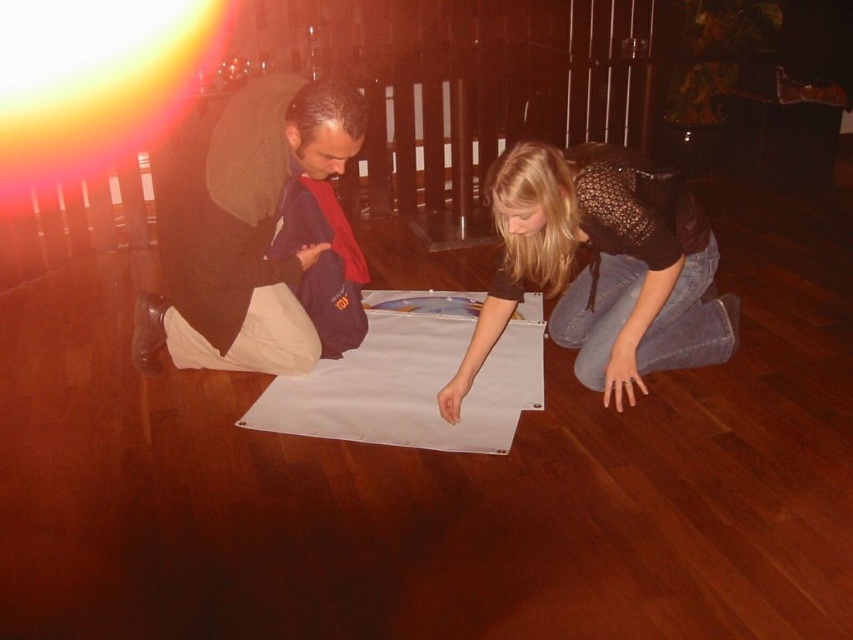
Question: In this image, where is denim jeans at lower right located relative to white matte cloth at center?

Choices:
 (A) below
 (B) above

Answer: (B)

Question: Which of these objects is positioned closest to the dark blue fabric at left?

Choices:
 (A) white matte cloth at center
 (B) denim jeans at lower right

Answer: (A)

Question: Which object appears farthest from the camera in this image?

Choices:
 (A) white matte cloth at center
 (B) dark blue fabric at left
 (C) denim jeans at lower right

Answer: (A)

Question: Is dark blue fabric at left positioned behind white matte cloth at center?

Choices:
 (A) no
 (B) yes

Answer: (A)

Question: Does dark blue fabric at left have a smaller size compared to denim jeans at lower right?

Choices:
 (A) no
 (B) yes

Answer: (B)

Question: Which is farther from the dark blue fabric at left?

Choices:
 (A) denim jeans at lower right
 (B) white matte cloth at center

Answer: (A)